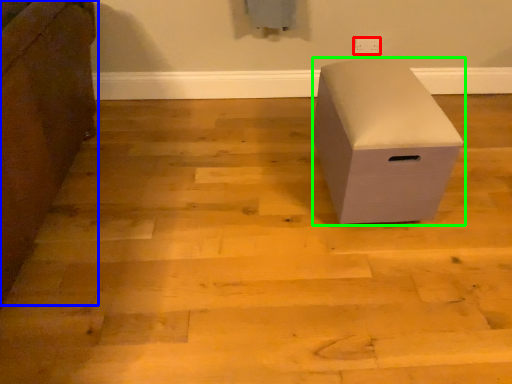
Question: Which object is the closest to the electric outlet (highlighted by a red box)? Choose among these: furniture (highlighted by a blue box) or furniture (highlighted by a green box).

Choices:
 (A) furniture
 (B) furniture

Answer: (B)